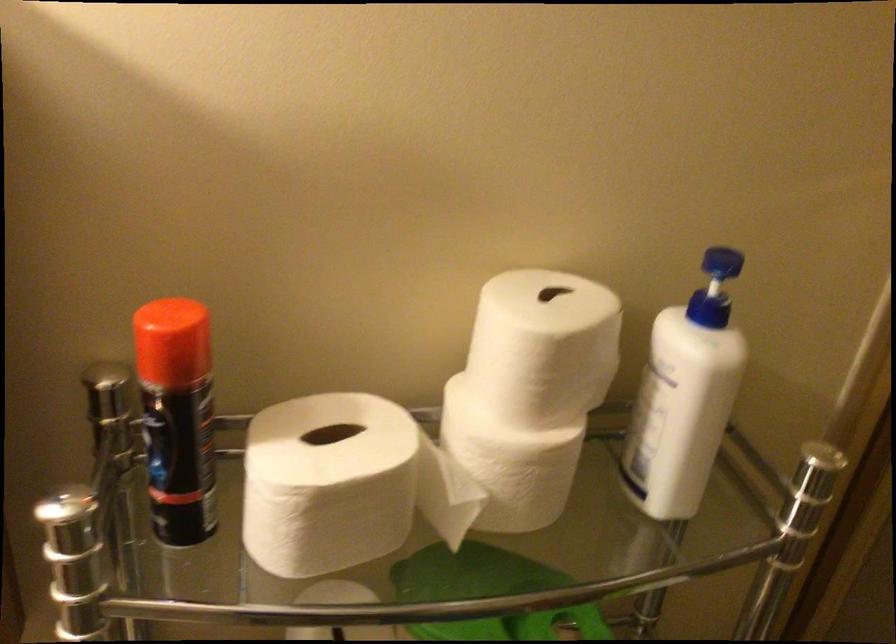
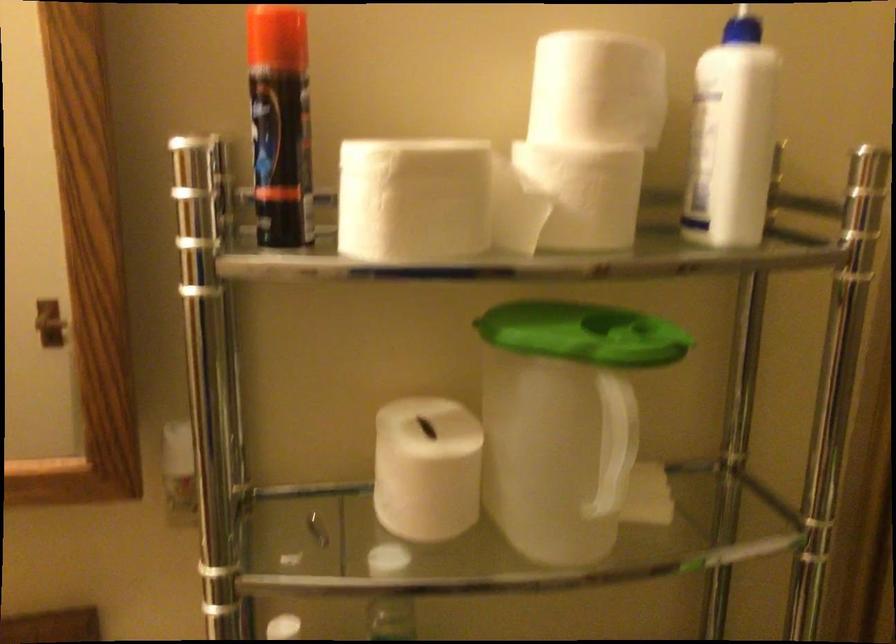
The point at [718,288] is marked in the first image. Where is the corresponding point in the second image?

(742, 28)